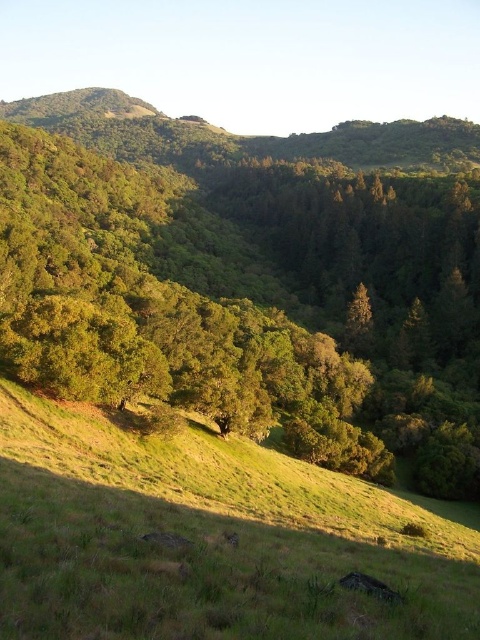
How far apart are green leafy tree at center and green grassy hillside at lower center?

green leafy tree at center is 92.15 meters from green grassy hillside at lower center.

Does green leafy tree at center have a lesser height compared to green grassy hillside at lower center?

In fact, green leafy tree at center may be taller than green grassy hillside at lower center.

Where is `green leafy tree at center`? green leafy tree at center is located at coordinates (253, 292).

This screenshot has width=480, height=640. In order to click on green leafy tree at center in this screenshot , I will do `click(253, 292)`.